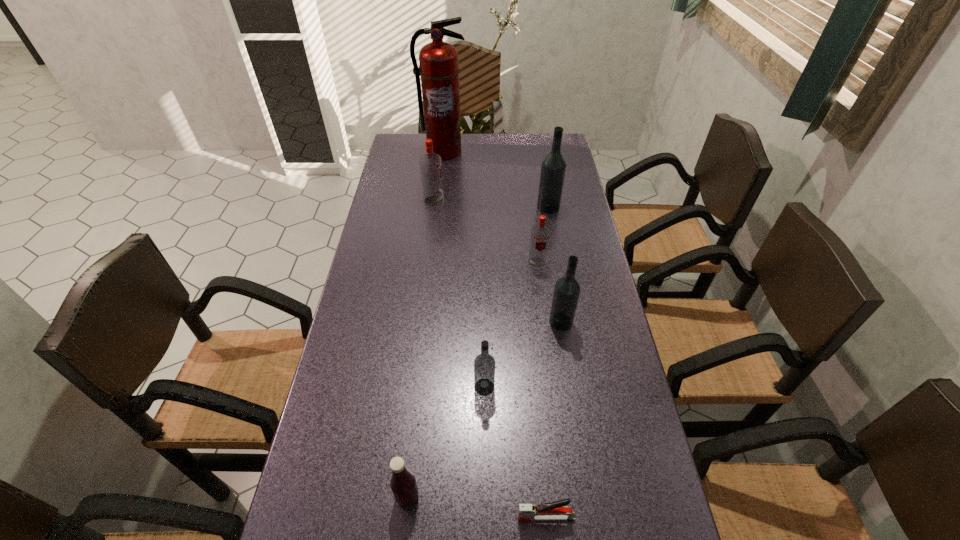
This screenshot has height=540, width=960. I want to click on vacant region that satisfies the following two spatial constraints: 1. on the nozzle side of the tallest object; 2. on the right side of the second nearest black vodka, so [x=425, y=322].

This screenshot has height=540, width=960. I want to click on blank space that satisfies the following two spatial constraints: 1. on the front side of the biggest black vodka; 2. on the handle side of the shortest object, so click(x=603, y=517).

I want to click on vacant position in the image that satisfies the following two spatial constraints: 1. on the front label of the Tabasco sauce; 2. on the left side of the farther red vodka, so click(398, 496).

Find the location of a particular element. Image resolution: width=960 pixels, height=540 pixels. vacant space that satisfies the following two spatial constraints: 1. on the front label of the farthest black vodka; 2. on the right side of the left red vodka is located at coordinates (433, 207).

Find the location of a particular element. free space that satisfies the following two spatial constraints: 1. on the nozzle side of the fifth object from right to left; 2. on the left side of the tallest object is located at coordinates (418, 387).

You are a GUI agent. You are given a task and a screenshot of the screen. Output one action in this format:
    pyautogui.click(x=<x>, y=<y>)
    Task: Click on the vacant region that satisfies the following two spatial constraints: 1. on the back side of the biggest black vodka; 2. on the left side of the fourth nearest object
    
    Given the screenshot: What is the action you would take?
    pyautogui.click(x=542, y=207)

This screenshot has width=960, height=540. In order to click on free space that satisfies the following two spatial constraints: 1. on the front label of the right red vodka; 2. on the handle side of the gray stapler in this screenshot , I will do `click(569, 517)`.